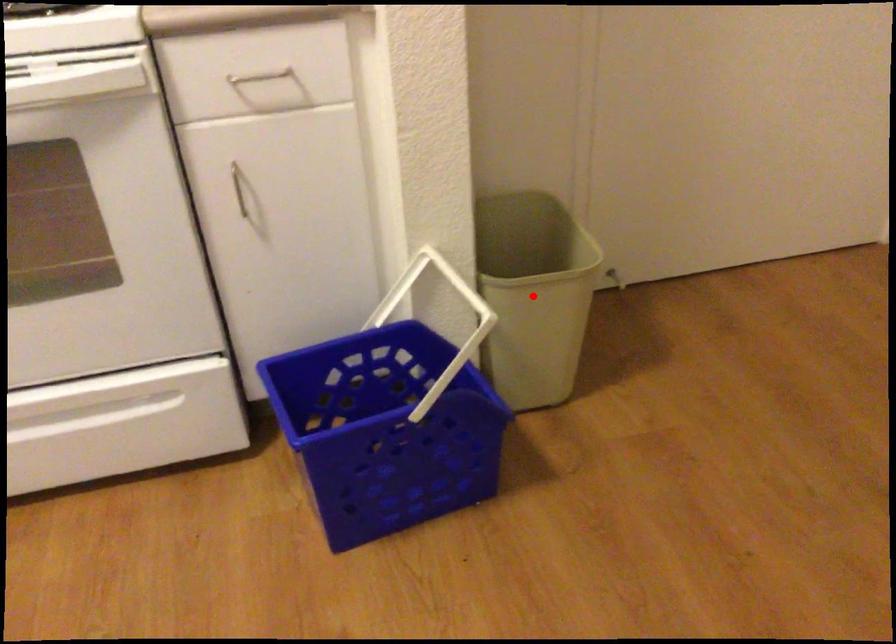
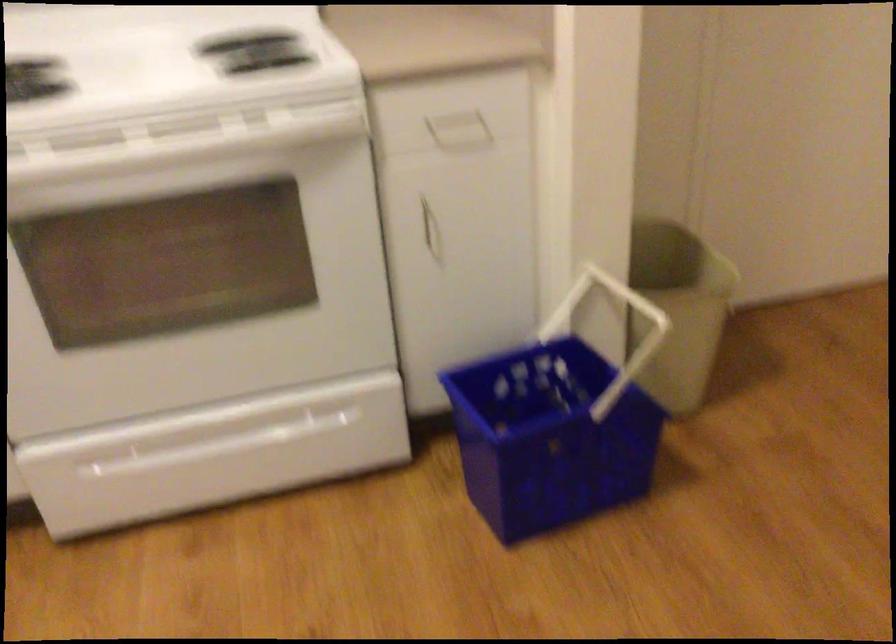
The point at the highlighted location is marked in the first image. Where is the corresponding point in the second image?

(678, 308)